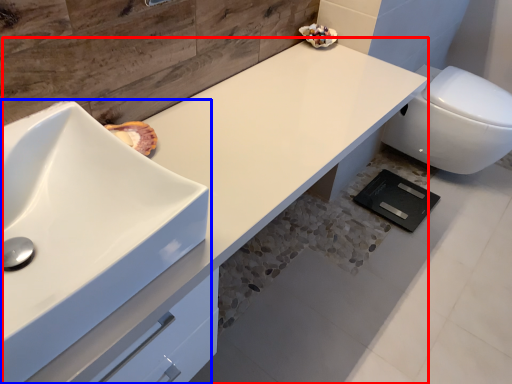
Question: Which object appears farthest to the camera in this image, counter top (highlighted by a red box) or sink (highlighted by a blue box)?

Choices:
 (A) counter top
 (B) sink

Answer: (A)